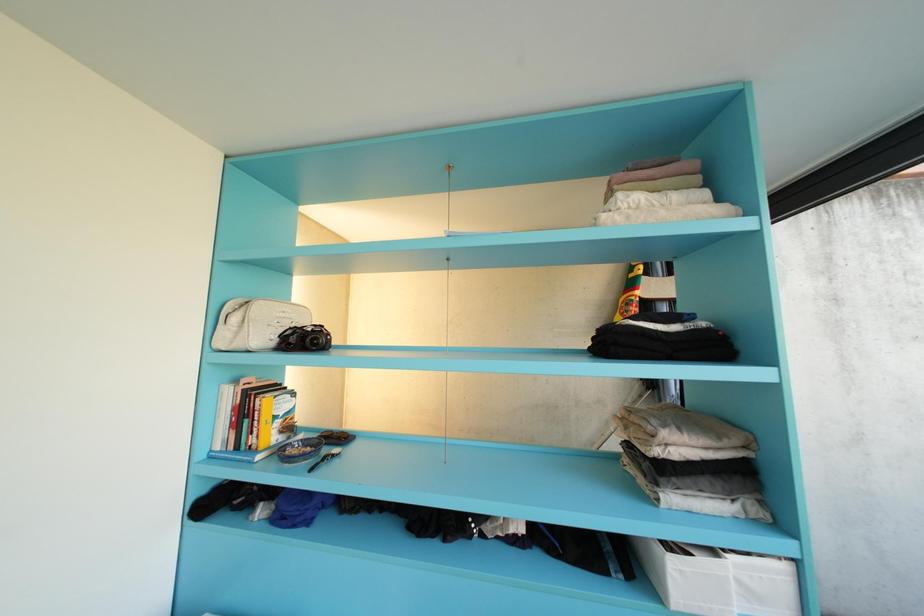
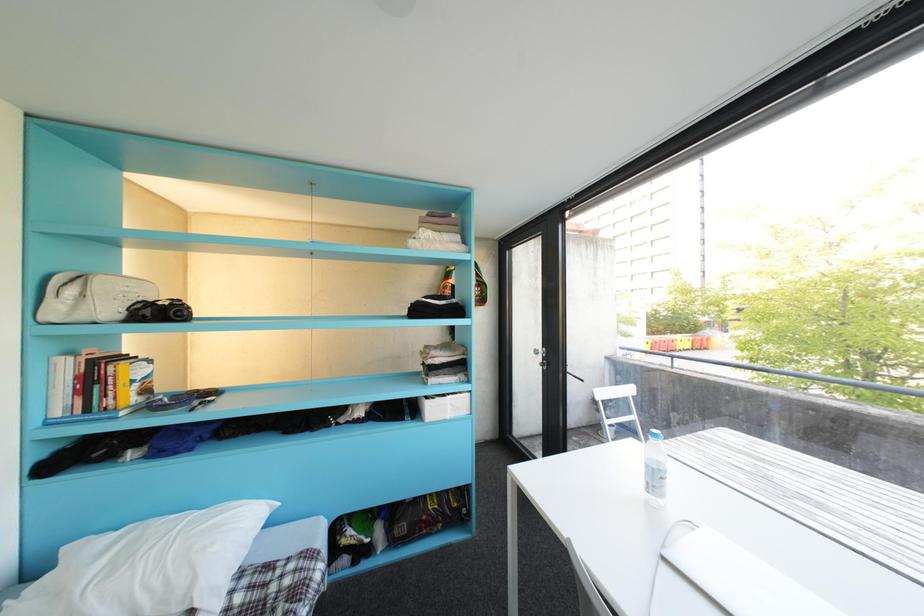
Question: The first image is from the beginning of the video and the second image is from the end. How did the camera likely rotate when shooting the video?

Choices:
 (A) Left
 (B) Right
 (C) Up
 (D) Down

Answer: (B)